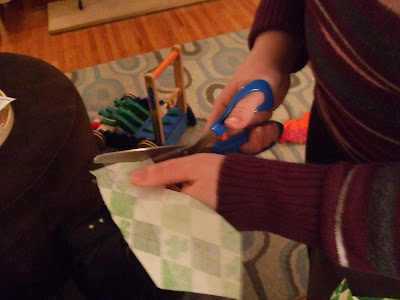
Image resolution: width=400 pixels, height=300 pixels. In order to click on carpet in this screenshot , I will do `click(218, 67)`.